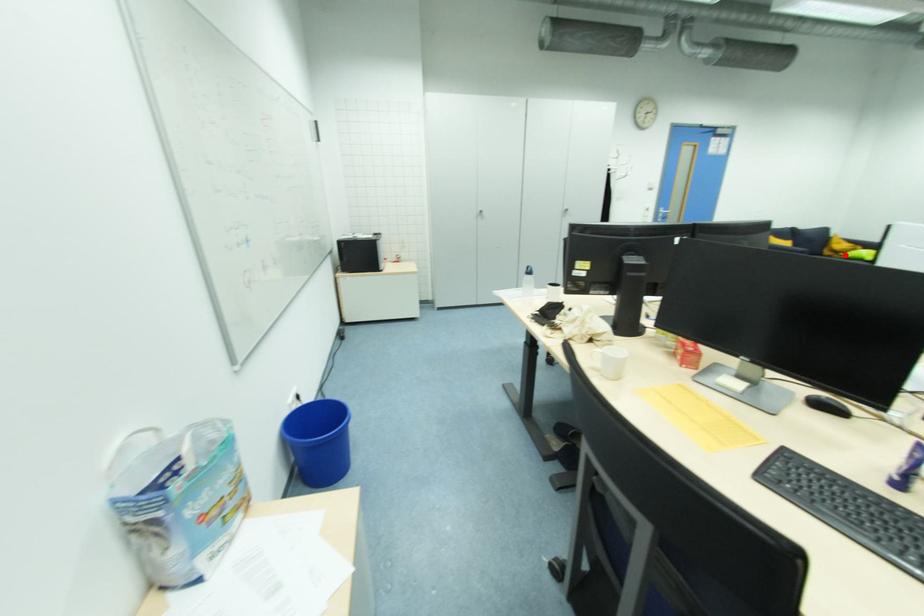
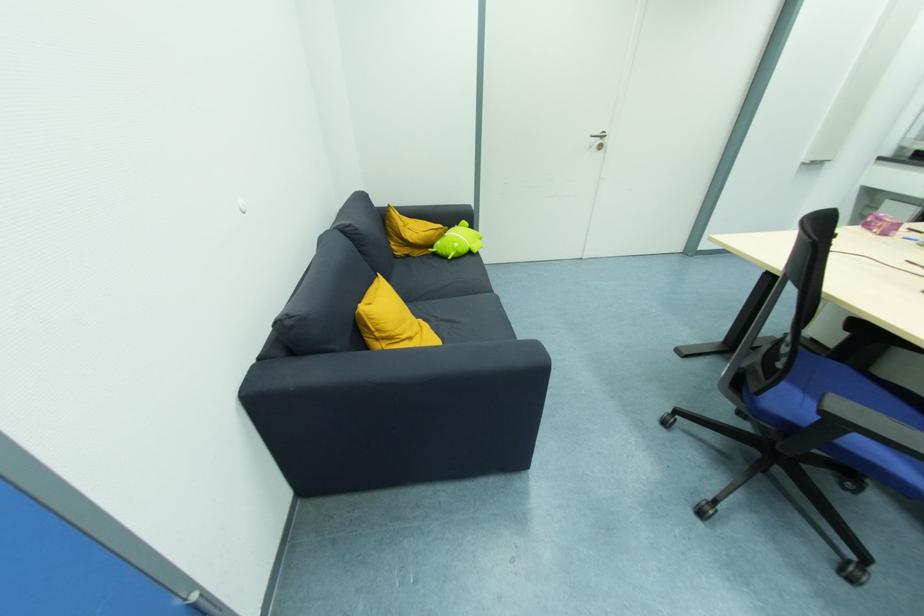
The point at the highlighted location is marked in the first image. Where is the corresponding point in the second image?

(435, 248)